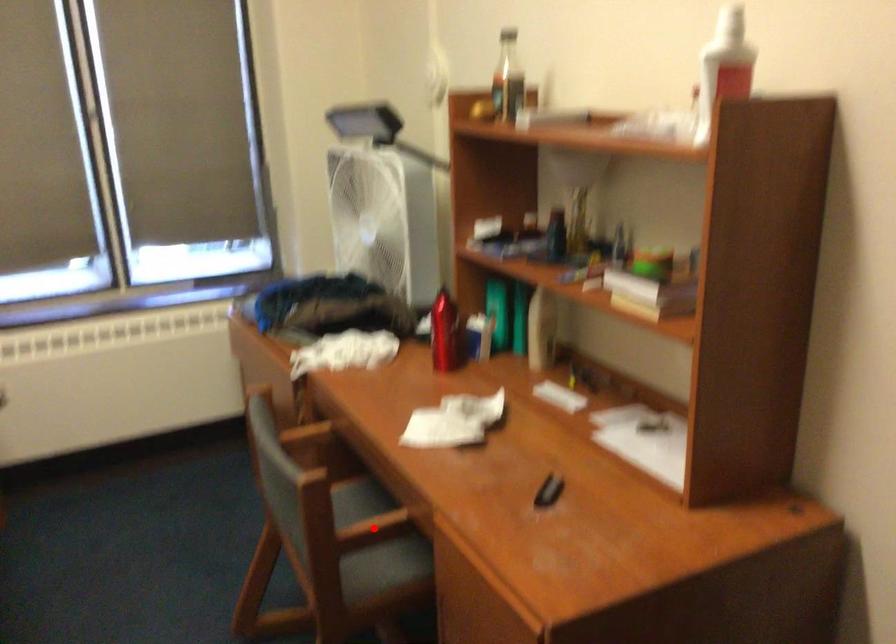
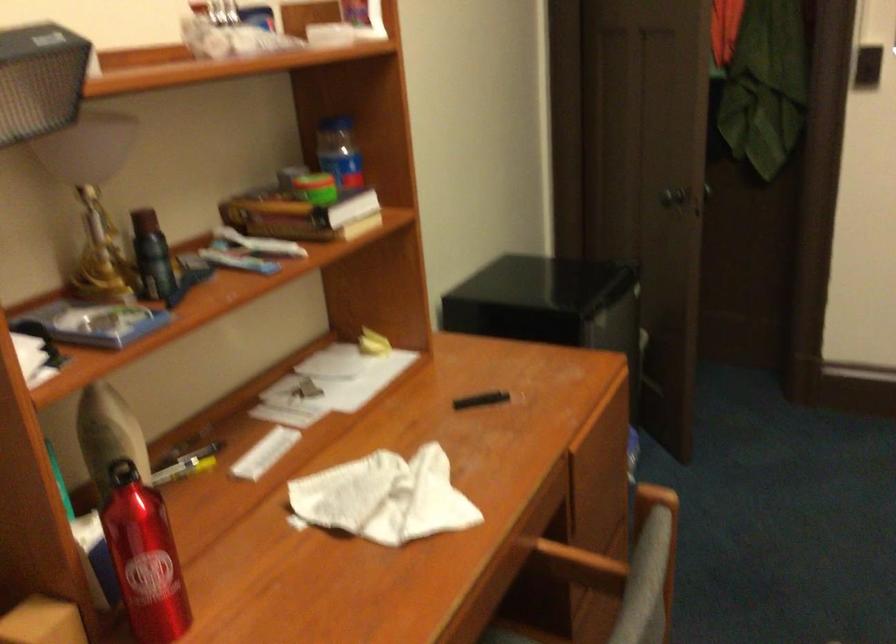
Question: I am providing you with two images of the same scene from different viewpoints. Given a red point in image1, look at the same physical point in image2. Is it:

Choices:
 (A) Closer to the viewpoint
 (B) Farther from the viewpoint

Answer: (A)